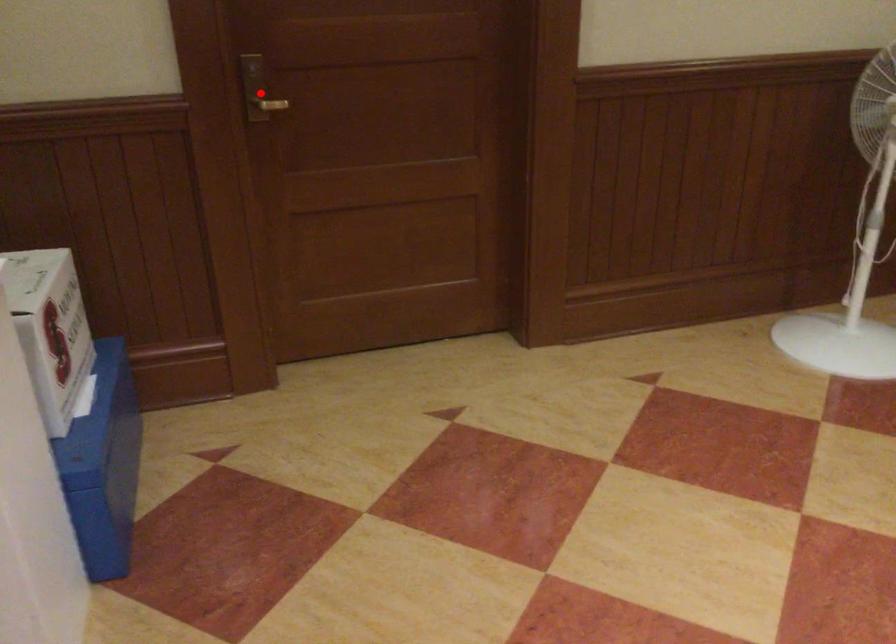
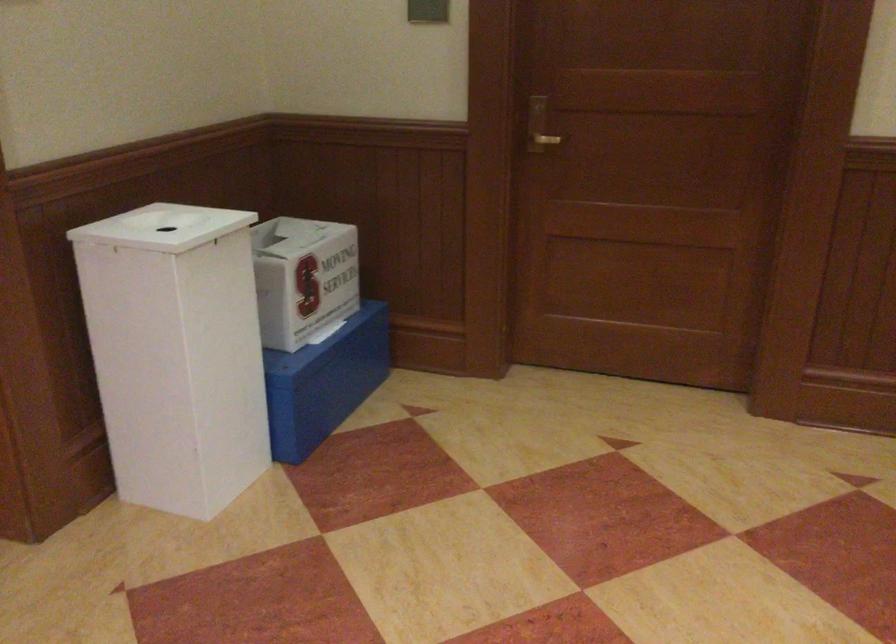
Question: I am providing you with two images of the same scene from different viewpoints. A red point is marked on the first image. Can you still see the location of the red point in image 2?

Choices:
 (A) Yes
 (B) No

Answer: (A)